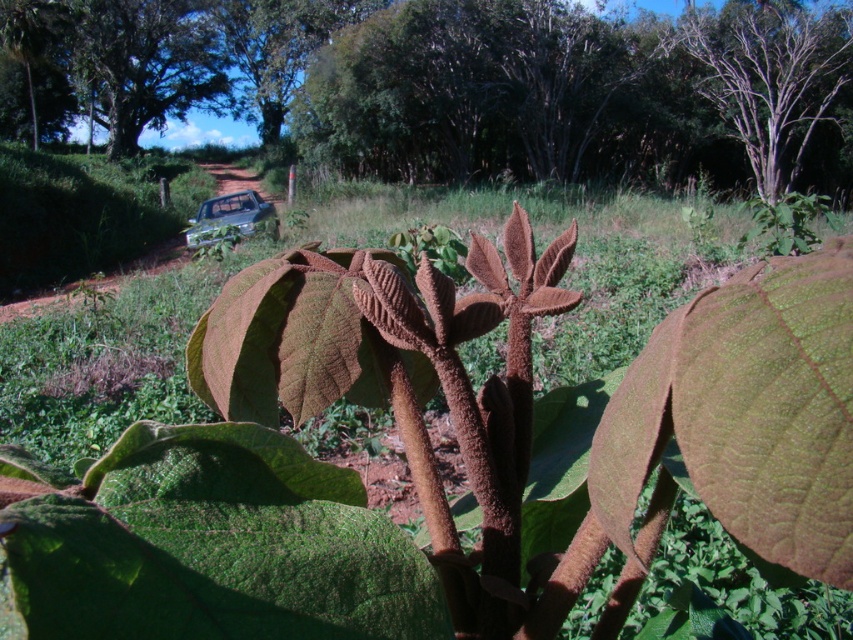
Between brown bark tree at upper right and metallic silver car at center, which one appears on the left side from the viewer's perspective?

From the viewer's perspective, metallic silver car at center appears more on the left side.

At what (x,y) coordinates should I click in order to perform the action: click on brown bark tree at upper right. Please return your answer as a coordinate pair (x, y). Image resolution: width=853 pixels, height=640 pixels. Looking at the image, I should click on (769, 76).

You are a GUI agent. You are given a task and a screenshot of the screen. Output one action in this format:
    pyautogui.click(x=<x>, y=<y>)
    Task: Click on the brown bark tree at upper right
    
    Given the screenshot: What is the action you would take?
    pyautogui.click(x=769, y=76)